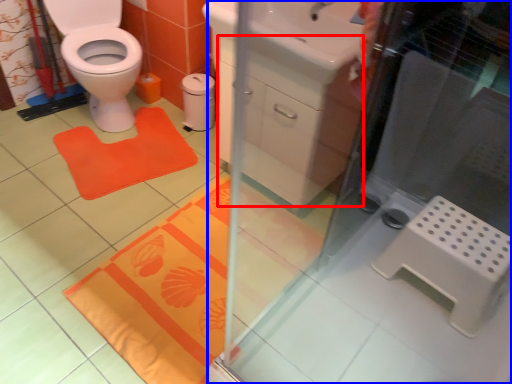
Question: Which of the following is the farthest to the observer, drawer (highlighted by a red box) or screen door (highlighted by a blue box)?

Choices:
 (A) drawer
 (B) screen door

Answer: (A)